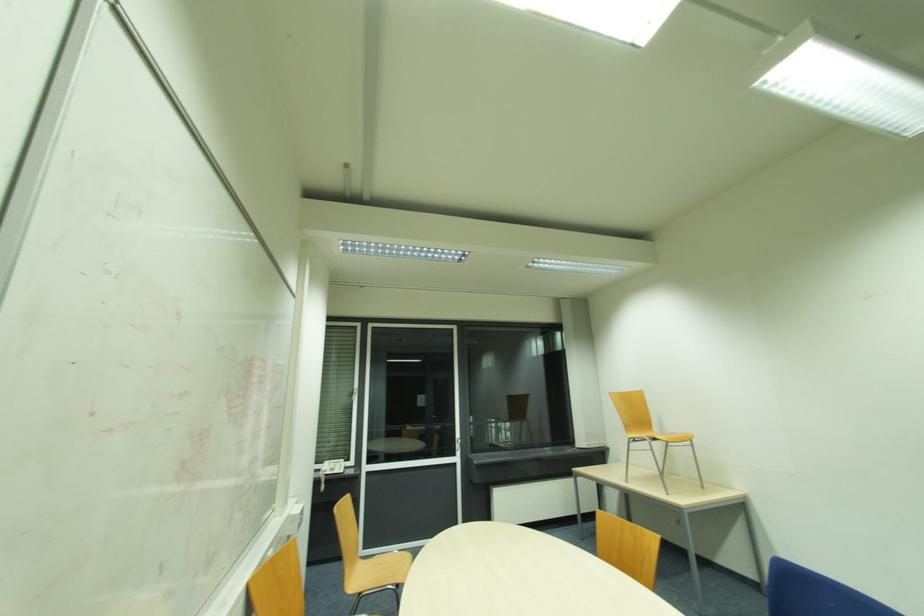
I want to click on yellow chair sitting surface, so click(x=383, y=567).